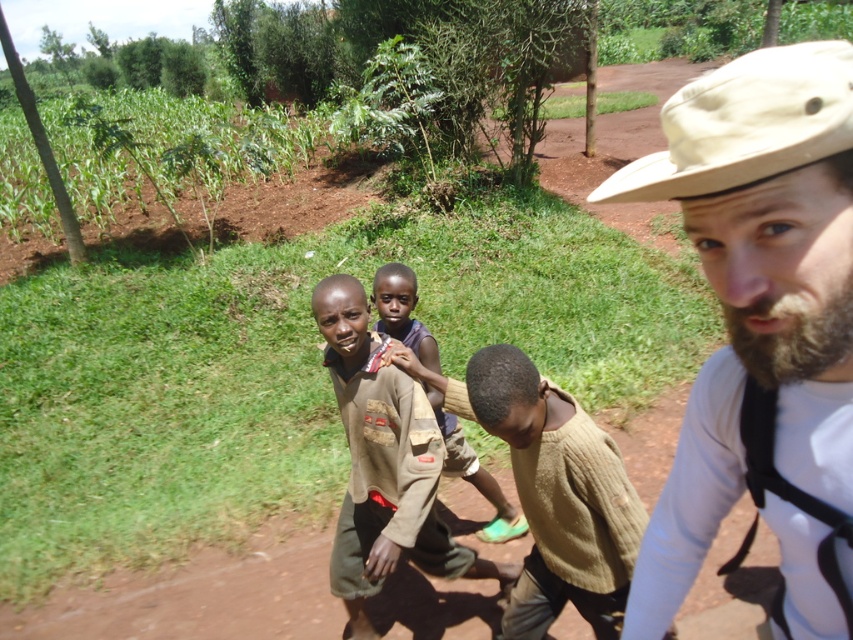
Which is behind, point (634, 140) or point (432, 360)?

Positioned behind is point (634, 140).

Is point (608, 148) behind point (500, 538)?

Yes, point (608, 148) is behind point (500, 538).

Identify the location of brown soil at center. (296, 200).

Does point (769, 88) come farther from viewer compared to point (386, 289)?

No, (769, 88) is closer to viewer.

Can you confirm if beige fabric hat at upper right is thinner than brown knitted sweater at center?

Indeed, beige fabric hat at upper right has a lesser width compared to brown knitted sweater at center.

Is point (699, 531) positioned after point (381, 307)?

No.

At what (x,y) coordinates should I click in order to perform the action: click on beige fabric hat at upper right. Please return your answer as a coordinate pair (x, y). This screenshot has height=640, width=853. Looking at the image, I should click on (755, 291).

Between knitted beige sweater at center and brown knitted sweater at center, which one has less height?

With less height is knitted beige sweater at center.

Is point (532, 420) behind point (469, 461)?

No.

Find the location of a particular element. The image size is (853, 640). knitted beige sweater at center is located at coordinates (552, 490).

In order to click on knitted beige sweater at center in this screenshot , I will do click(552, 490).